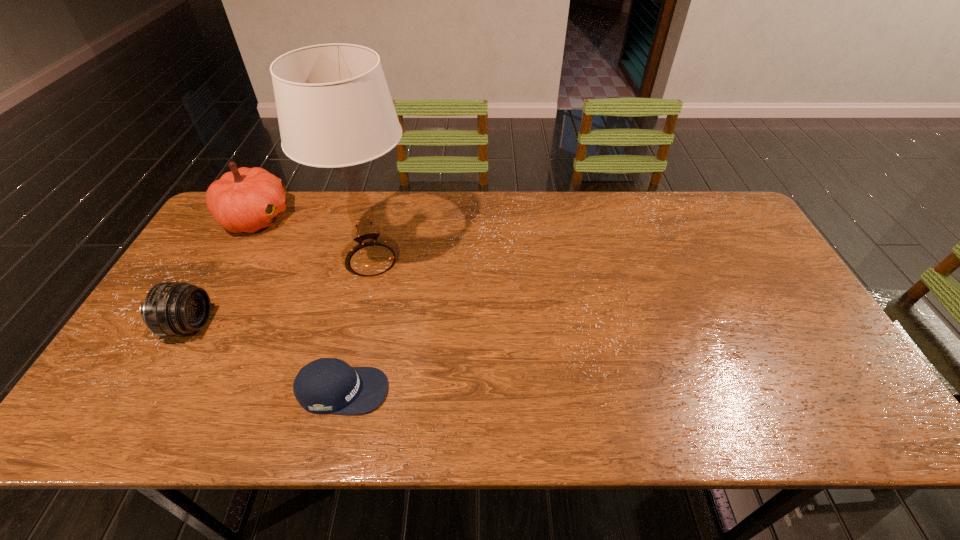
Identify the location of table lamp present at the far edge. The width and height of the screenshot is (960, 540). (334, 108).

Where is `pumpkin that is at the far edge`? pumpkin that is at the far edge is located at coordinates (245, 199).

Locate an element on the screen. This screenshot has width=960, height=540. object that is at the near edge is located at coordinates (327, 385).

The width and height of the screenshot is (960, 540). I want to click on pumpkin that is positioned at the left edge, so tap(245, 199).

This screenshot has width=960, height=540. I want to click on telephoto lens at the left edge, so click(170, 309).

The height and width of the screenshot is (540, 960). In order to click on object that is at the far left corner in this screenshot , I will do `click(245, 199)`.

The height and width of the screenshot is (540, 960). I want to click on blank area at the far edge, so click(x=324, y=204).

Locate an element on the screen. free spot at the near edge of the desktop is located at coordinates (531, 433).

At what (x,y) coordinates should I click in order to perform the action: click on vacant region at the left edge of the desktop. Please return your answer as a coordinate pair (x, y). The height and width of the screenshot is (540, 960). Looking at the image, I should click on (223, 273).

This screenshot has width=960, height=540. I want to click on vacant space at the right edge of the desktop, so click(775, 339).